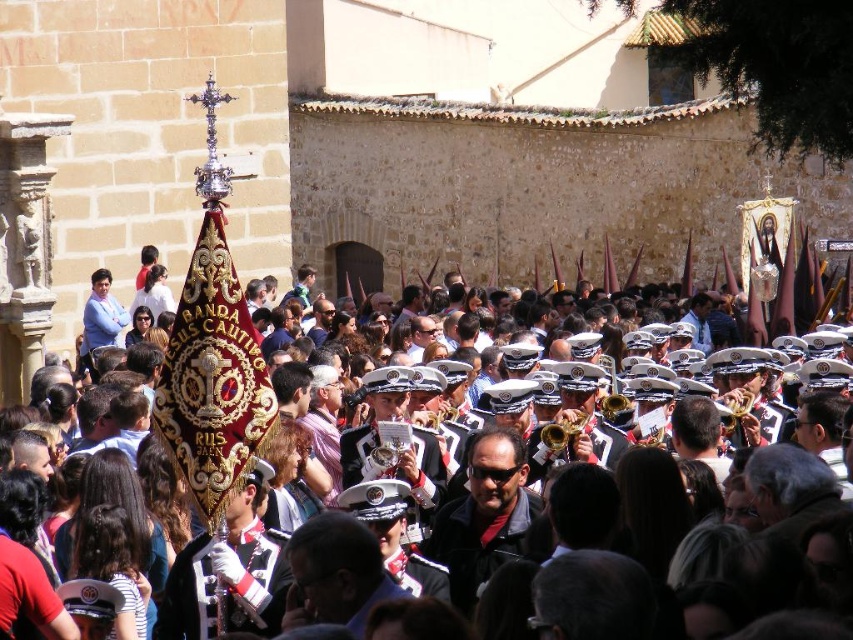
Question: Can you confirm if velvet red banner at center is wider than gold brass trumpet at center?

Choices:
 (A) no
 (B) yes

Answer: (B)

Question: Is velvet red banner at center thinner than gold brass trumpet at center?

Choices:
 (A) no
 (B) yes

Answer: (A)

Question: Is velvet red banner at center thinner than gold brass trumpet at center?

Choices:
 (A) no
 (B) yes

Answer: (A)

Question: Which object is farther from the camera taking this photo?

Choices:
 (A) velvet red banner at center
 (B) gold brass trumpet at center

Answer: (B)